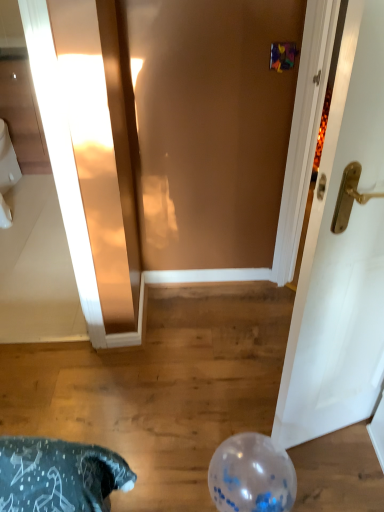
This screenshot has width=384, height=512. I want to click on vacant space to the right of transparent plastic balloon at lower center, so click(x=340, y=472).